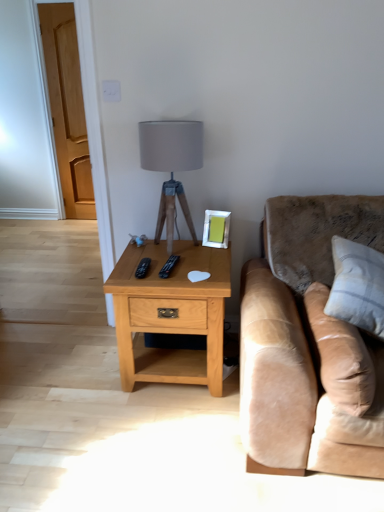
Find the location of a particular element. The height and width of the screenshot is (512, 384). vacant area in front of light oak wood nightstand at center is located at coordinates (162, 439).